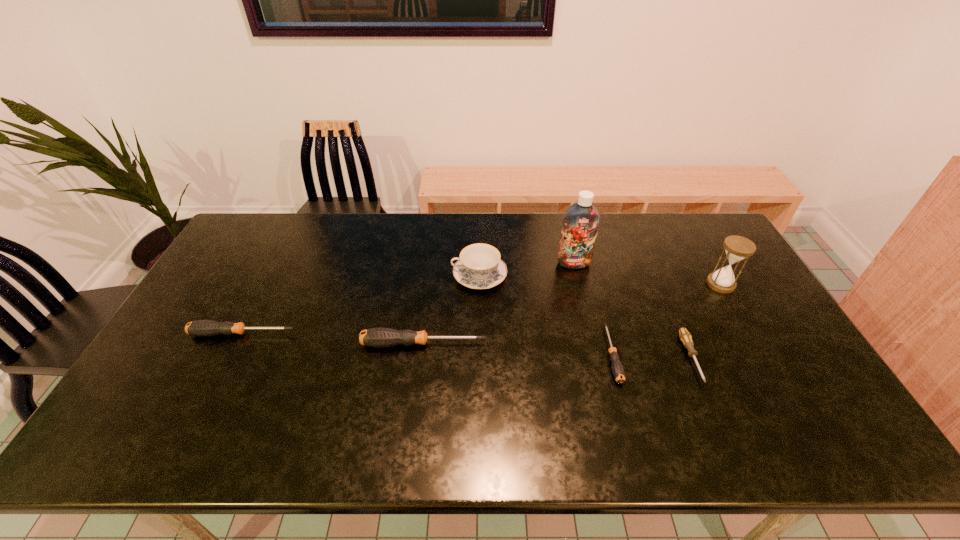
I want to click on the leftmost screwdriver, so click(203, 328).

The width and height of the screenshot is (960, 540). Find the location of `the fifth tallest object`. the fifth tallest object is located at coordinates (203, 328).

Locate an element on the screen. the third screwdriver from right to left is located at coordinates (380, 337).

Locate an element on the screen. The image size is (960, 540). the second screwdriver from right to left is located at coordinates (617, 368).

In order to click on the second tallest object in this screenshot , I will do `click(737, 248)`.

I want to click on hourglass, so click(737, 248).

Where is `the tallest object`? the tallest object is located at coordinates (581, 220).

Where is `the fifth shortest object`? The height and width of the screenshot is (540, 960). the fifth shortest object is located at coordinates (479, 267).

Find the location of `the sixth object from left to right`. the sixth object from left to right is located at coordinates (685, 336).

The height and width of the screenshot is (540, 960). In order to click on vacant space located 0.350m on the back of the third shortest object in this screenshot , I will do `click(284, 251)`.